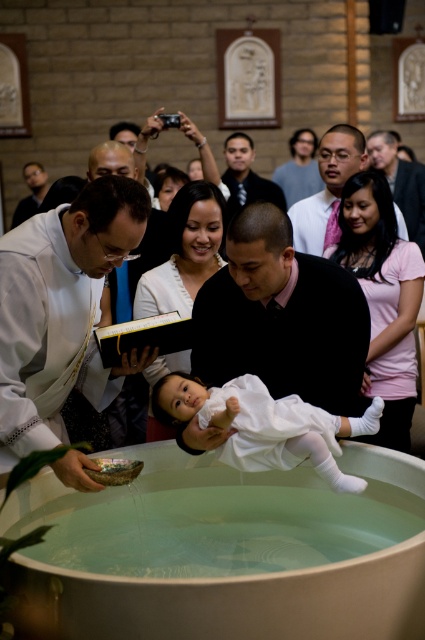
You are a photographer standing at the back of the church during the baptism ceremony. You want to take a photo that includes both the white clothed priest at left and the gray sweater at upper center. The camera you are using has a maximum zoom range that can capture objects up to 5 meters apart. Can you fit both subjects into the frame without moving closer?

The white clothed priest at left and gray sweater at upper center are 5.83 meters apart from each other. Since the maximum zoom range is 5 meters, the photographer cannot fit both subjects into the frame without moving closer.

Based on the scene description, where is the pink satin tie at upper center located in the image?

The pink satin tie at upper center is located at the coordinates point (x=328, y=188) in the image.